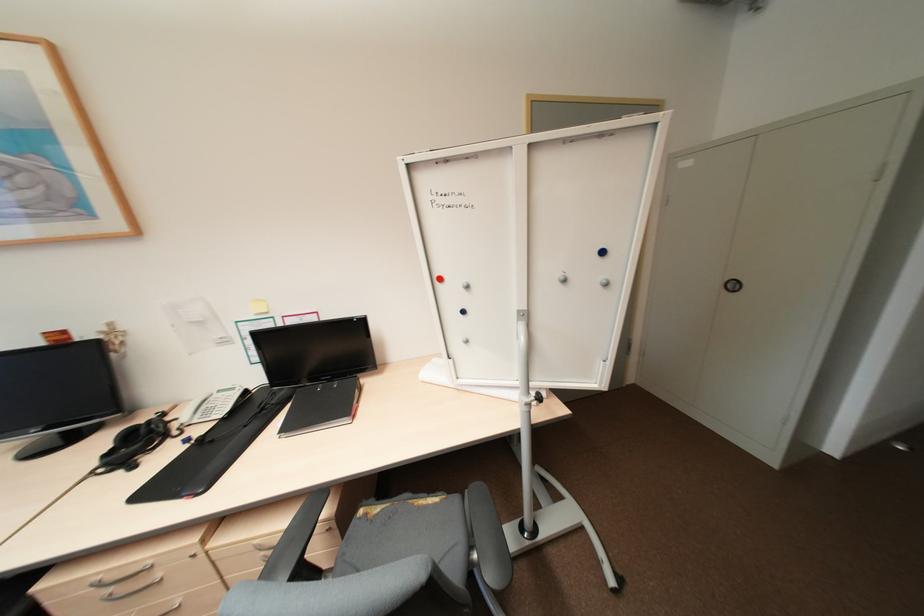
You are a GUI agent. You are given a task and a screenshot of the screen. Output one action in this format:
    pyautogui.click(x=<x>, y=<y>)
    Task: Click on the black cabinet handle
    
    Given the screenshot: What is the action you would take?
    pyautogui.click(x=733, y=285)